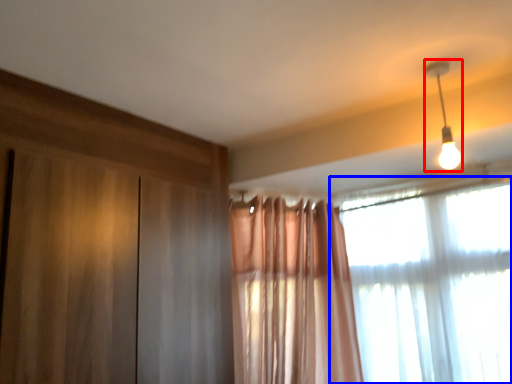
Question: Which point is further to the camera, lamp (highlighted by a red box) or window (highlighted by a blue box)?

Choices:
 (A) lamp
 (B) window

Answer: (B)